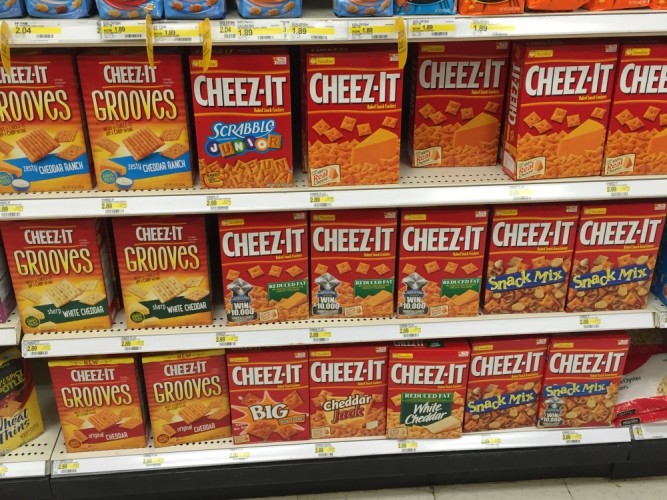
Where is `top shelf of crackers`? The height and width of the screenshot is (500, 667). top shelf of crackers is located at coordinates (55, 142), (151, 142), (229, 133), (348, 124), (432, 124), (562, 140), (647, 141).